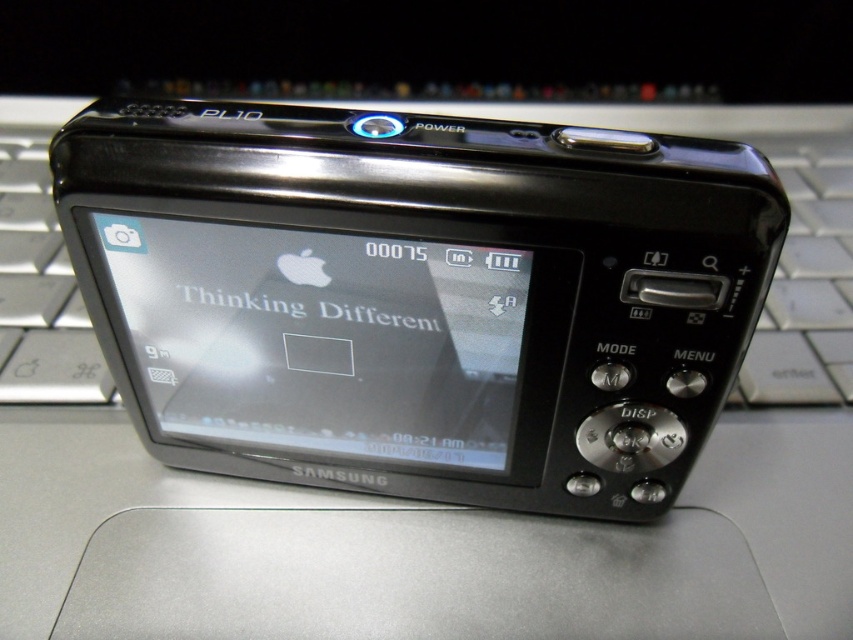
You are a photographer trying to take a photo of the silver metallic keyboard at center using the matte black screen at center. Can you do this without moving the camera?

The matte black screen at center is positioned under the silver metallic keyboard at center, so the camera cannot take a photo of the silver metallic keyboard at center while it is placed underneath it.

You are holding a Samsung PL10 digital camera and notice two parts at the center of the camera. One is the matte black screen at center and the other is the silver metallic keyboard at center. Which part is narrower in width?

The matte black screen at center is thinner than silver metallic keyboard at center, so the matte black screen at center is narrower in width.

You are setting up a photography setup and need to position the matte black screen at center and the silver metallic keyboard at center correctly. According to the scene, which object is positioned to the left?

The matte black screen at center is to the left of the silver metallic keyboard at center.